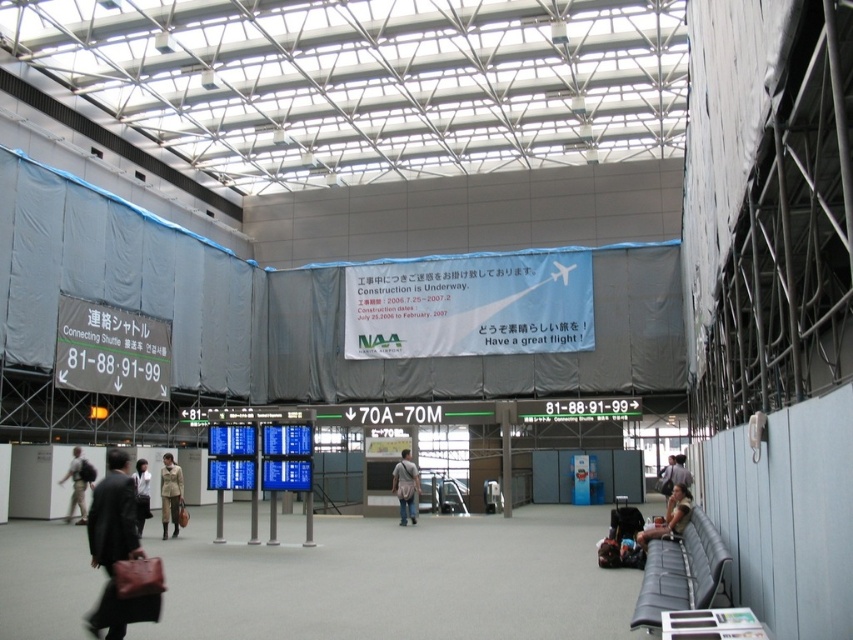
Looking at this image, between leather brown bag at lower left and light brown leather jacket at lower left, which one has more height?

leather brown bag at lower left

Who is more forward, (102,627) or (140,522)?

Positioned in front is point (102,627).

Between point (90, 625) and point (146, 497), which one is positioned behind?

Point (146, 497)

The width and height of the screenshot is (853, 640). I want to click on leather brown bag at lower left, so click(x=115, y=548).

What do you see at coordinates (170, 493) in the screenshot? This screenshot has height=640, width=853. I see `khaki fabric jacket at center` at bounding box center [170, 493].

Does khaki fabric jacket at center appear on the left side of denim jacket at center?

Indeed, khaki fabric jacket at center is positioned on the left side of denim jacket at center.

Does point (181, 484) come farther from viewer compared to point (404, 488)?

No, it is not.

This screenshot has width=853, height=640. I want to click on khaki fabric jacket at center, so click(170, 493).

Is point (86, 516) closer to camera compared to point (142, 520)?

No.

This screenshot has width=853, height=640. I want to click on khaki pants at center, so click(x=78, y=483).